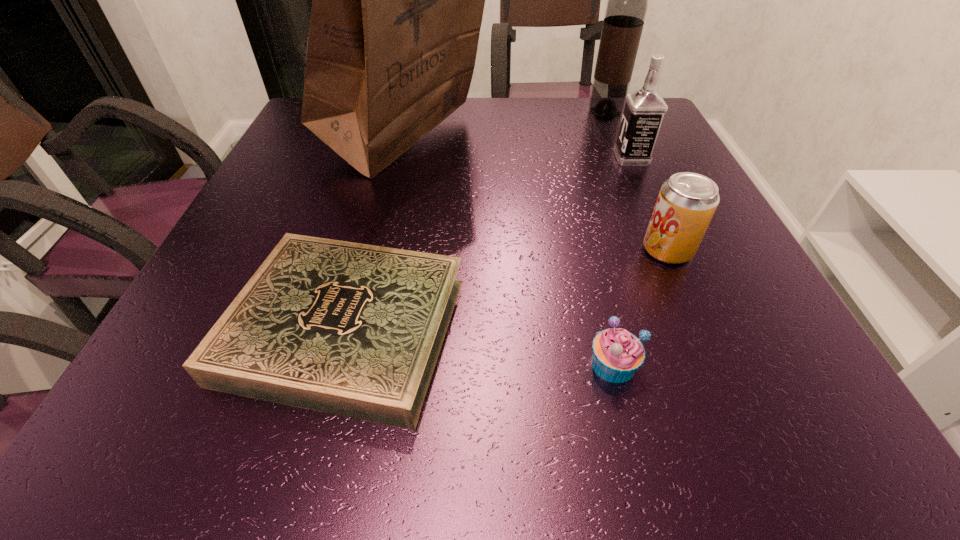
You are a GUI agent. You are given a task and a screenshot of the screen. Output one action in this format:
    pyautogui.click(x=<x>, y=<y>)
    Task: Click on the object identified as the fourth closest to the tallest object
    
    Given the screenshot: What is the action you would take?
    [x=644, y=110]

I want to click on the closest object to the pop (soda), so click(x=617, y=354).

You are a GUI agent. You are given a task and a screenshot of the screen. Output one action in this format:
    pyautogui.click(x=<x>, y=<y>)
    Task: Click on the vacant space that satisfies the following two spatial constraints: 1. on the back side of the muffin; 2. on the left side of the pop (soda)
    
    Given the screenshot: What is the action you would take?
    click(x=586, y=250)

This screenshot has height=540, width=960. What are the coordinates of `vacant space that satisfies the following two spatial constraints: 1. on the back side of the shortest object; 2. on the right side of the fourth tallest object` in the screenshot? It's located at (366, 250).